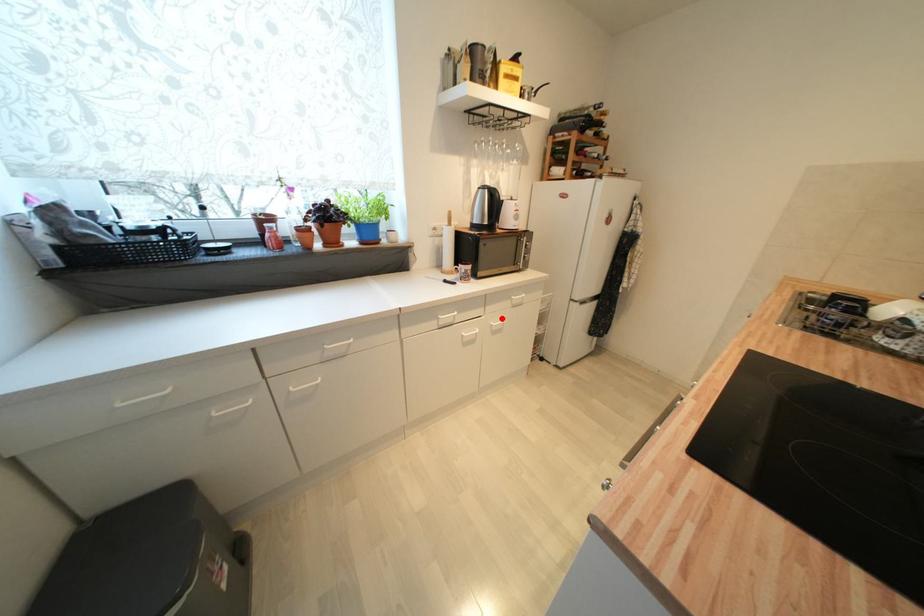
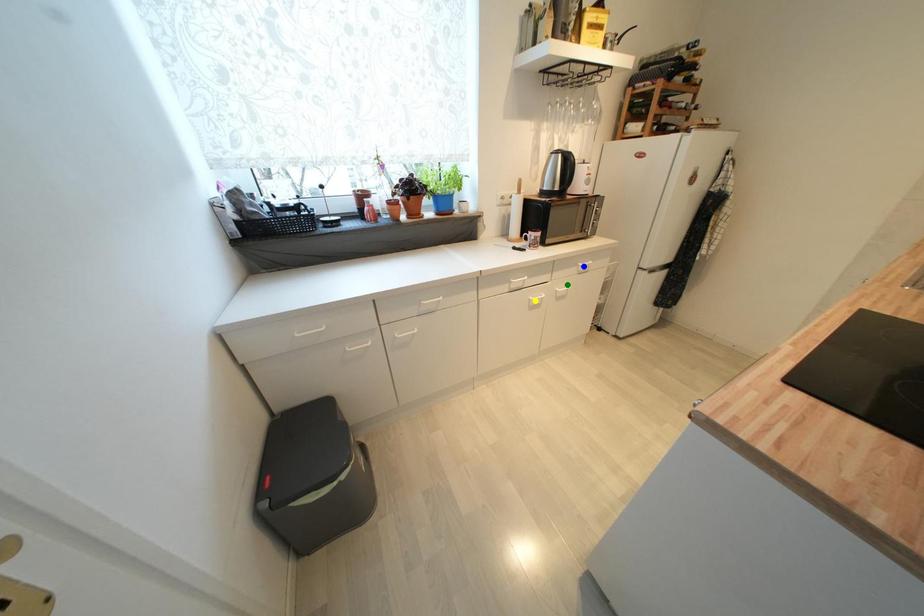
Question: I am providing you with two images of the same scene from different viewpoints. A red point is marked on the first image. You are given multiple points on the second image. Which point in image 2 is actually the same real-world point as the red point in image 1?

Choices:
 (A) green point
 (B) yellow point
 (C) blue point

Answer: (A)